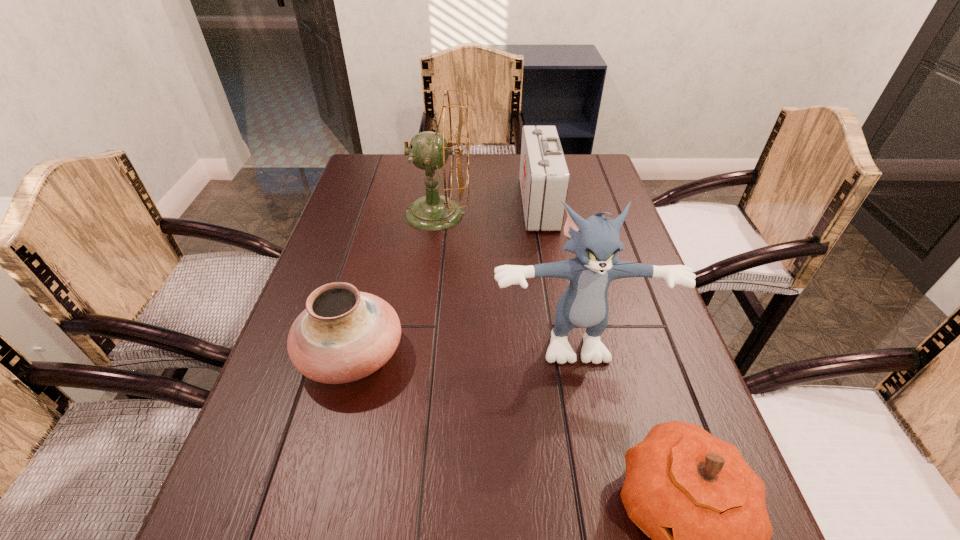
The height and width of the screenshot is (540, 960). I want to click on fan that is at the far edge, so click(428, 150).

At what (x,y) coordinates should I click in order to perform the action: click on the first-aid kit that is positioned at the far edge. Please return your answer as a coordinate pair (x, y). The image size is (960, 540). Looking at the image, I should click on 544,177.

Locate an element on the screen. The image size is (960, 540). object positioned at the left edge is located at coordinates (343, 335).

Find the location of a particular element. Image resolution: width=960 pixels, height=540 pixels. object at the right edge is located at coordinates (595, 241).

The height and width of the screenshot is (540, 960). Find the location of `vacant space at the far edge of the desktop`. vacant space at the far edge of the desktop is located at coordinates 481,162.

The image size is (960, 540). What are the coordinates of `vacant region at the left edge of the desktop` in the screenshot? It's located at (281, 372).

This screenshot has height=540, width=960. What are the coordinates of `free spot at the right edge of the desktop` in the screenshot? It's located at (620, 386).

In the image, there is a desktop. At what (x,y) coordinates should I click in order to perform the action: click on free space at the far right corner. Please return your answer as a coordinate pair (x, y). This screenshot has width=960, height=540. Looking at the image, I should click on (577, 154).

The height and width of the screenshot is (540, 960). Find the location of `free area in between the first-aid kit and the fan`. free area in between the first-aid kit and the fan is located at coordinates (488, 208).

Where is `vacant space that's between the fan and the first-aid kit`? The height and width of the screenshot is (540, 960). vacant space that's between the fan and the first-aid kit is located at coordinates (488, 208).